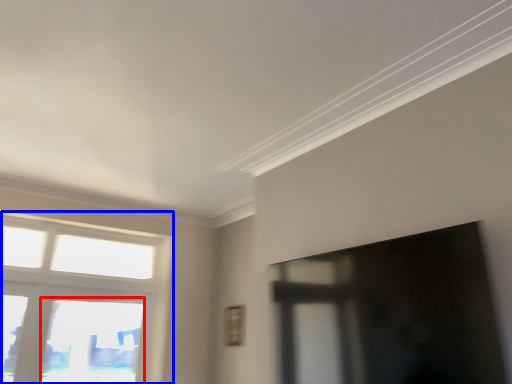
Question: Which point is closer to the camera, window (highlighted by a red box) or window (highlighted by a blue box)?

Choices:
 (A) window
 (B) window

Answer: (B)